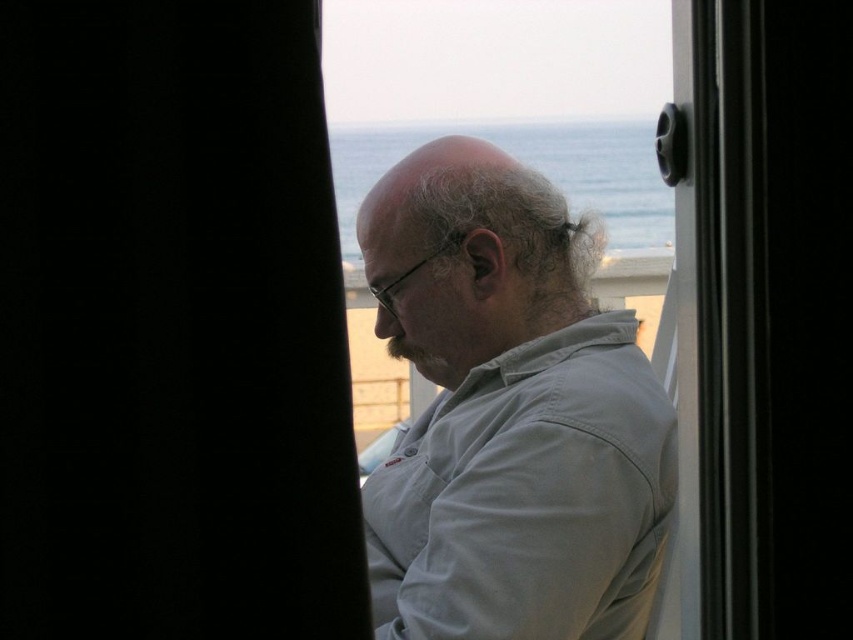
Question: Which point is farther to the camera?

Choices:
 (A) (183, 333)
 (B) (473, 237)

Answer: (B)

Question: Which point is farther from the camera taking this photo?

Choices:
 (A) (621, 611)
 (B) (108, 420)

Answer: (A)

Question: Does black fabric curtain at left appear over gray cotton shirt at center?

Choices:
 (A) yes
 (B) no

Answer: (A)

Question: Where is black fabric curtain at left located in relation to gray cotton shirt at center in the image?

Choices:
 (A) below
 (B) above

Answer: (B)

Question: Is black fabric curtain at left to the right of gray cotton shirt at center from the viewer's perspective?

Choices:
 (A) no
 (B) yes

Answer: (A)